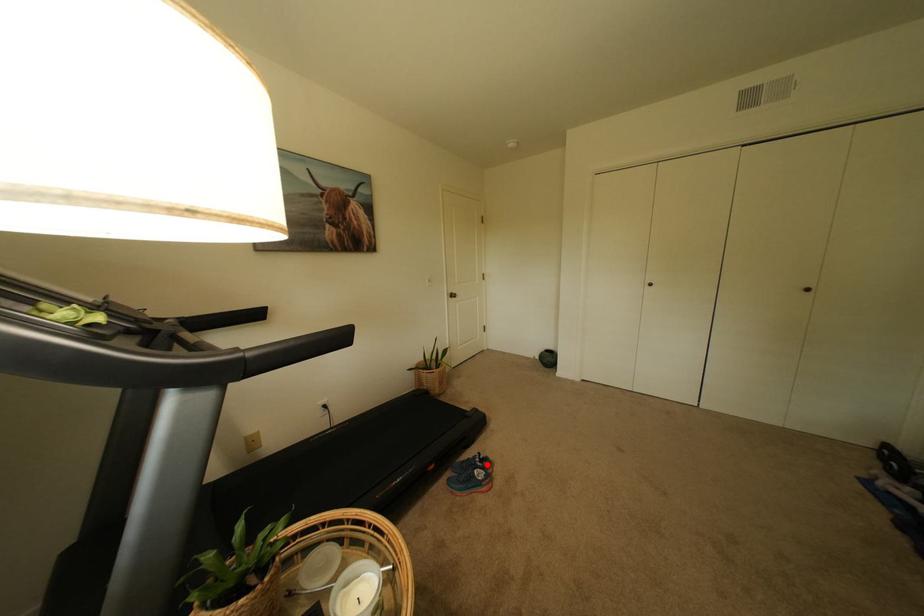
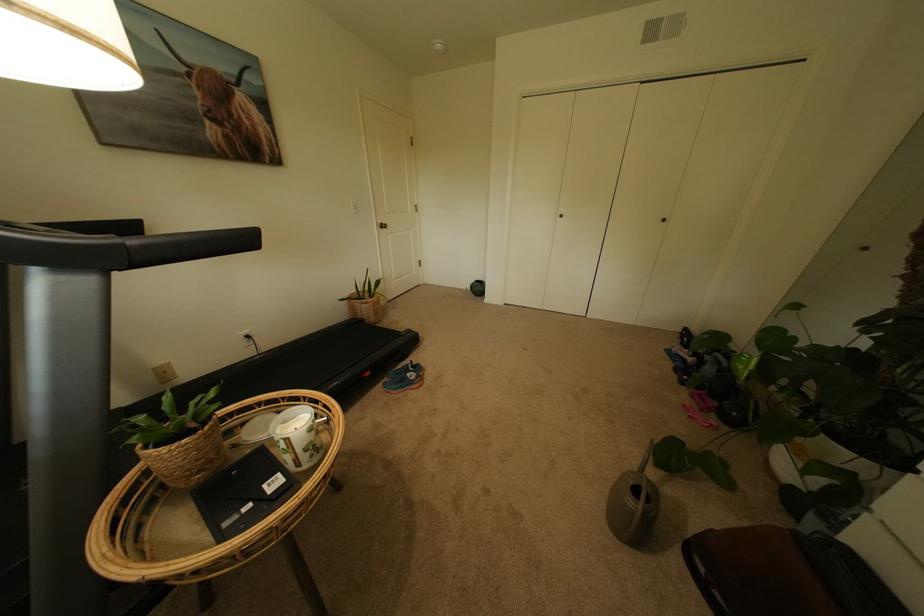
Locate, in the second image, the point that corresponds to the highlighted location in the first image.

(419, 370)